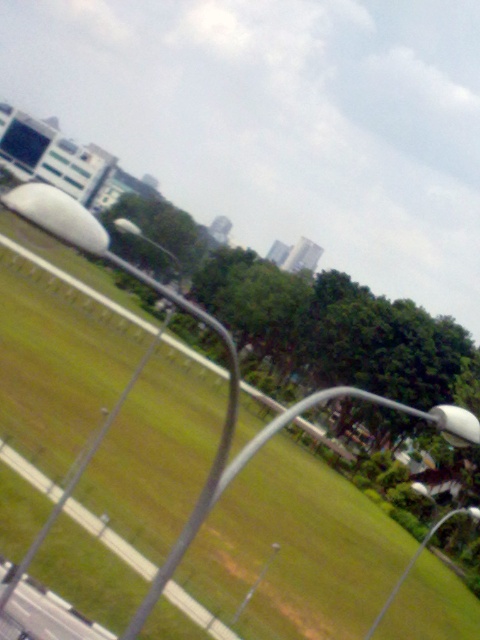
Can you confirm if green grass at center is wider than white glossy lamp post at lower right?

Yes, green grass at center is wider than white glossy lamp post at lower right.

Does green grass at center lie in front of white glossy lamp post at lower right?

Yes, green grass at center is in front of white glossy lamp post at lower right.

Where is `green grass at center`? green grass at center is located at coordinates (296, 548).

What are the coordinates of `green grass at center` in the screenshot? It's located at (296, 548).